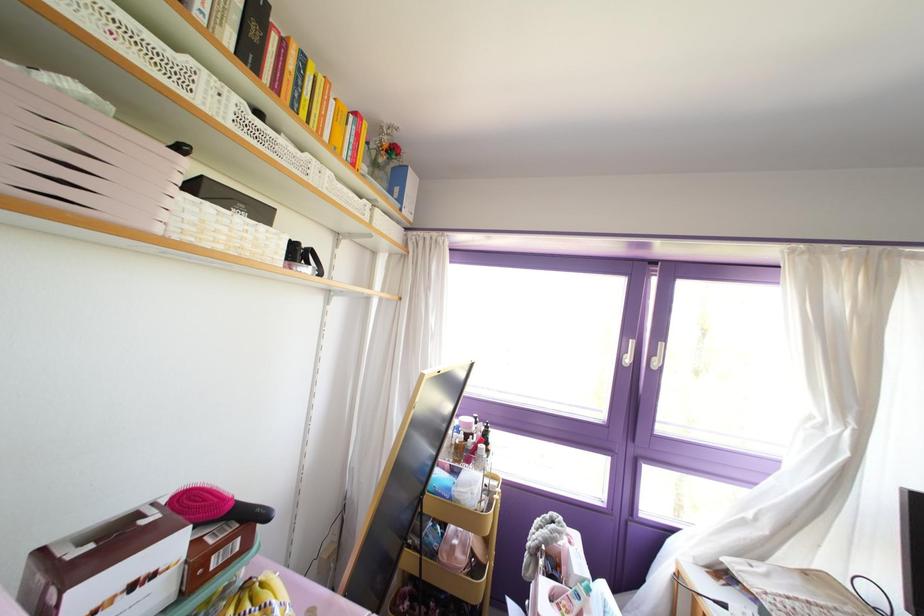
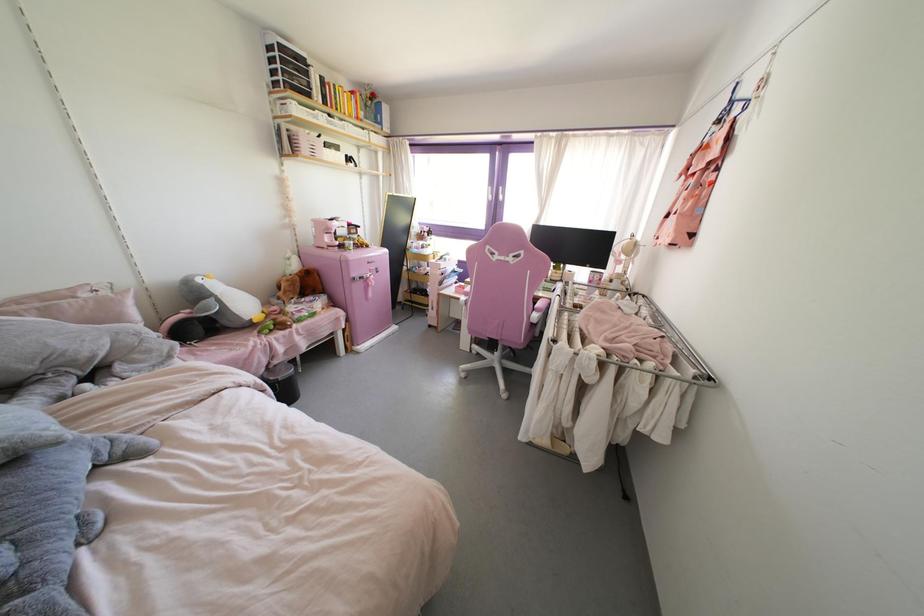
Which direction would the cameraman need to move to produce the second image?

The cameraman walked toward right, backward.